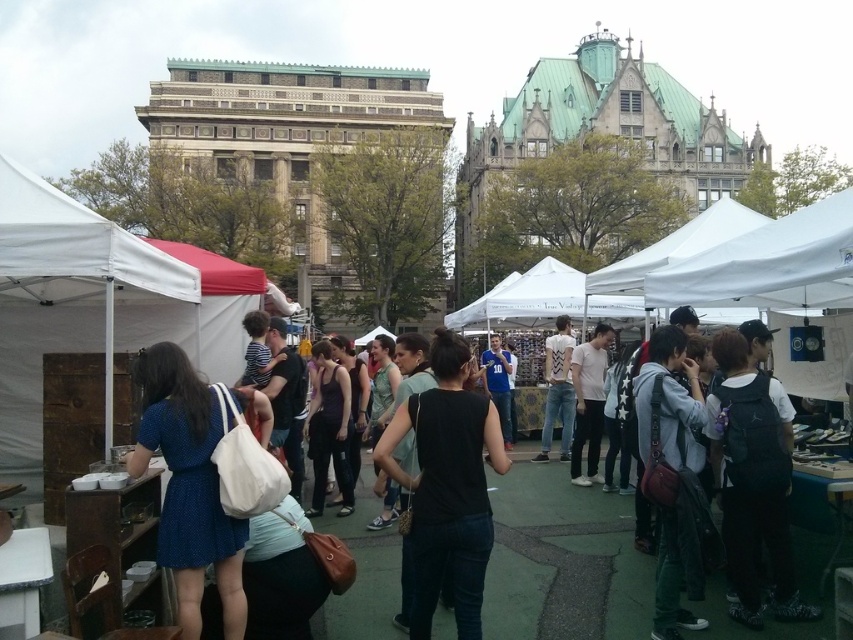
You are a photographer standing in the middle of the market. You want to take a photo that includes both the white fabric canopy at upper right and the white fabric canopy at center. Which canopy will appear larger in the photo?

The white fabric canopy at upper right will appear larger in the photo because it is much taller than the white fabric canopy at center.

You are a photographer standing at the edge of the market. You want to take a photo of the white fabric canopy at center and the white matte shirt at center without any obstructions. Which object should you position closer to the camera to ensure both are visible clearly?

The white fabric canopy at center is in front of the white matte shirt at center. To ensure both are visible clearly without obstructions, you should position the white fabric canopy at center closer to the camera so it doesn not block the white matte shirt at center behind it.

Consider the image. You are a photographer trying to capture both the matte purple tank top at center and the white matte shirt at center in a single frame. Which object should you focus on first to ensure both are in the frame?

The matte purple tank top at center is much taller than the white matte shirt at center, so you should focus on the taller matte purple tank top at center first to ensure both are in the frame.